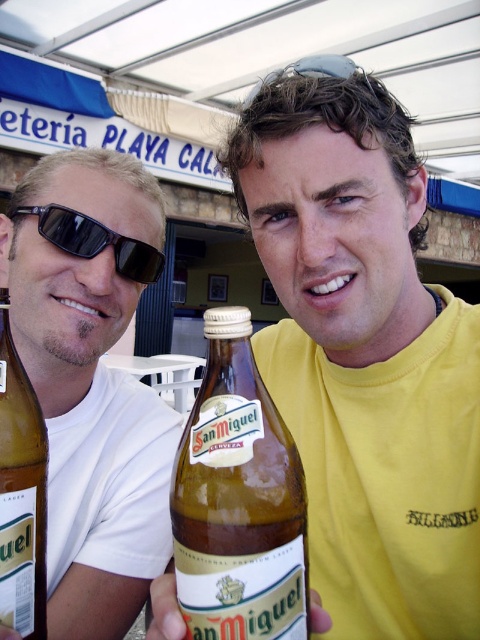
You are a photographer trying to capture a clear shot of the translucent glass bottle at center. The matte white shirt at center is blocking your view. Which direction should you move to avoid the obstruction?

The matte white shirt at center is to the left of the translucent glass bottle at center, so moving to the right side of the bottle would allow you to avoid the obstruction caused by the shirt.

Based on the photo, you are a photographer adjusting the camera settings to capture the two main subjects in the image. You notice the translucent glass bottle at center and the sunglasses at center. Which object should you focus on first if you want to ensure both are in sharp focus, considering their sizes?

The sunglasses at center should be focused on first because they are wider than the translucent glass bottle at center, ensuring proper focus on the larger object first would help in achieving sharpness for both.